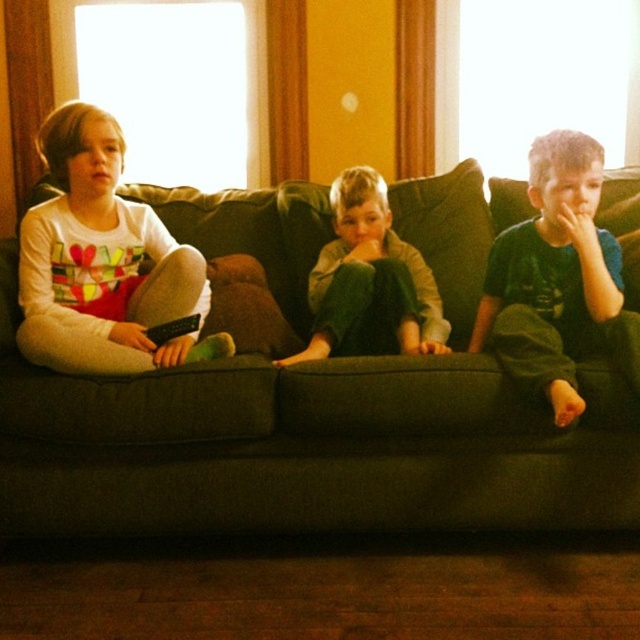
You are a tailor measuring the clothing of the children sitting on the sofa. Which clothing item has a greater width between the white soft shirt at left and the green cotton pants at center?

The white soft shirt at left has a greater width than the green cotton pants at center according to the description.

You are a photographer standing in front of the sofa. You want to take a photo that includes both the green fabric couch at center and the green cotton pants at center. Which object should you focus on first to ensure both are in sharp focus?

You should focus on the green fabric couch at center first because it is closer to the viewer than the green cotton pants at center, so starting with it ensures both will be in focus when adjusting the camera settings.